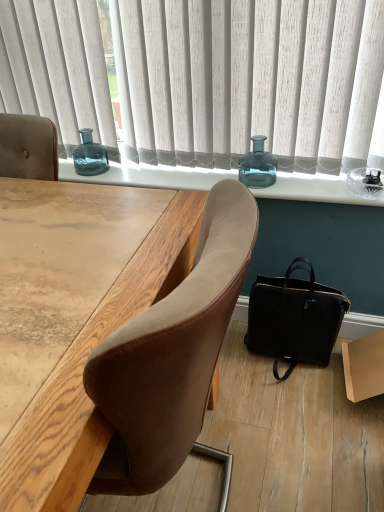
Question: Considering the relative sizes of brown cardboard box at lower right and white fabric curtain at upper center in the image provided, is brown cardboard box at lower right bigger than white fabric curtain at upper center?

Choices:
 (A) yes
 (B) no

Answer: (B)

Question: Would you say brown cardboard box at lower right is a long distance from white fabric curtain at upper center?

Choices:
 (A) no
 (B) yes

Answer: (A)

Question: Considering the relative sizes of brown cardboard box at lower right and white fabric curtain at upper center in the image provided, is brown cardboard box at lower right thinner than white fabric curtain at upper center?

Choices:
 (A) yes
 (B) no

Answer: (B)

Question: From a real-world perspective, is brown cardboard box at lower right positioned over white fabric curtain at upper center based on gravity?

Choices:
 (A) no
 (B) yes

Answer: (A)

Question: From the image's perspective, would you say brown cardboard box at lower right is shown under white fabric curtain at upper center?

Choices:
 (A) no
 (B) yes

Answer: (B)

Question: From the image's perspective, is brown cardboard box at lower right on top of white fabric curtain at upper center?

Choices:
 (A) no
 (B) yes

Answer: (A)

Question: Can you confirm if white fabric curtain at upper center is shorter than teal glass vase at center?

Choices:
 (A) yes
 (B) no

Answer: (B)

Question: Is white fabric curtain at upper center positioned beyond the bounds of teal glass vase at center?

Choices:
 (A) no
 (B) yes

Answer: (B)

Question: Is white fabric curtain at upper center to the left of teal glass vase at center from the viewer's perspective?

Choices:
 (A) no
 (B) yes

Answer: (B)

Question: Is white fabric curtain at upper center not near teal glass vase at center?

Choices:
 (A) no
 (B) yes

Answer: (A)

Question: Is white fabric curtain at upper center thinner than teal glass vase at center?

Choices:
 (A) no
 (B) yes

Answer: (B)

Question: Would you say teal glass vase at center is part of white fabric curtain at upper center's contents?

Choices:
 (A) yes
 (B) no

Answer: (B)

Question: From a real-world perspective, is teal glass bottle at upper center, arranged as the 2th bottle when viewed from the front, below brown cardboard box at lower right?

Choices:
 (A) yes
 (B) no

Answer: (B)